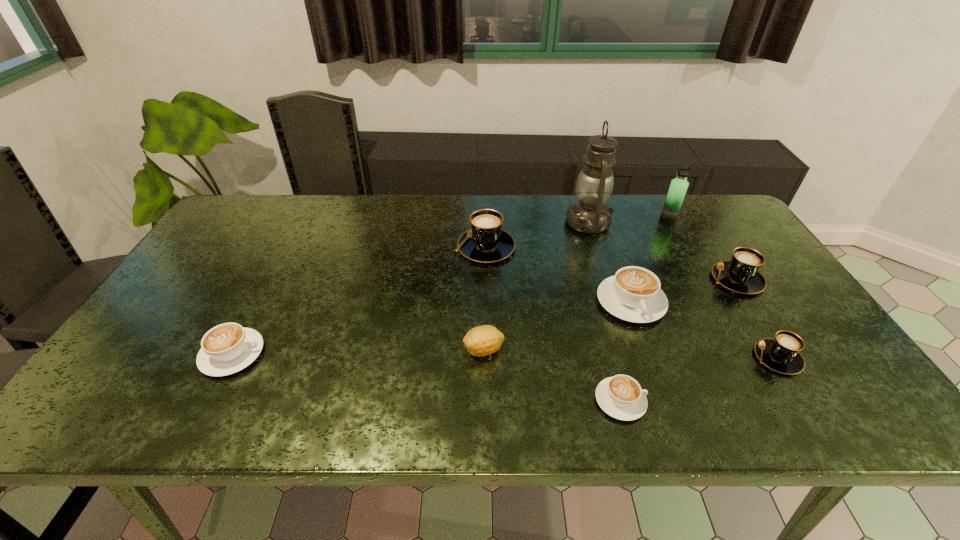
Where is `the smallest white cappuccino`? the smallest white cappuccino is located at coordinates (621, 397).

Where is `the shortest object`? the shortest object is located at coordinates (621, 397).

This screenshot has width=960, height=540. I want to click on vacant space located 0.150m on the right of the tallest object, so pos(658,222).

This screenshot has height=540, width=960. Identify the location of vacant space located on the front of the thermos bottle. (694, 264).

Image resolution: width=960 pixels, height=540 pixels. What are the coordinates of `vacant space located 0.190m on the right of the second cappuccino from left to right` in the screenshot? It's located at (578, 247).

Where is `free space located on the left of the second biggest black cappuccino`? The image size is (960, 540). free space located on the left of the second biggest black cappuccino is located at coordinates (660, 279).

Where is `free region located 0.200m on the side of the biggest white cappuccino with the handle`? The width and height of the screenshot is (960, 540). free region located 0.200m on the side of the biggest white cappuccino with the handle is located at coordinates (665, 397).

Find the location of a particular element. The image size is (960, 540). vacant space located at the stem end of the lemon is located at coordinates (418, 350).

The image size is (960, 540). Find the location of `vacant space positioned at the stem end of the lemon`. vacant space positioned at the stem end of the lemon is located at coordinates (430, 350).

Where is `vacant point located at the stem end of the lemon`? This screenshot has width=960, height=540. vacant point located at the stem end of the lemon is located at coordinates (354, 350).